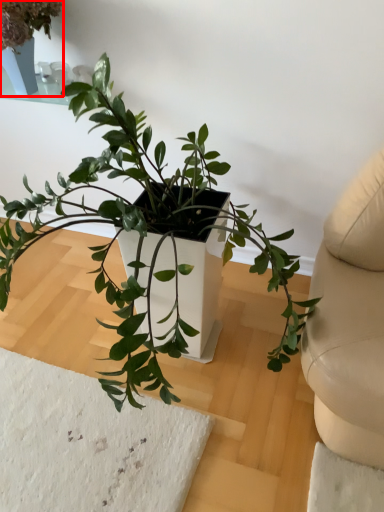
Question: From the image's perspective, where is houseplant (annotated by the red box) located in relation to houseplant in the image?

Choices:
 (A) below
 (B) above

Answer: (B)